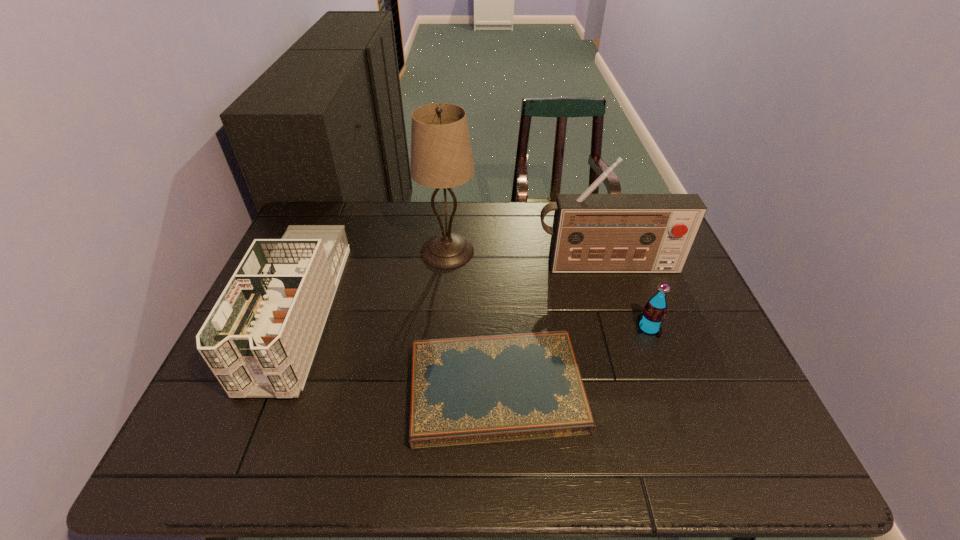
Identify the location of vacant space that satisfies the following two spatial constraints: 1. at the entrance of the leftmost object; 2. on the right side of the shortest object. click(267, 389).

Locate an element on the screen. Image resolution: width=960 pixels, height=540 pixels. free space that satisfies the following two spatial constraints: 1. at the entrance of the leftmost object; 2. on the left side of the paperback book is located at coordinates (267, 389).